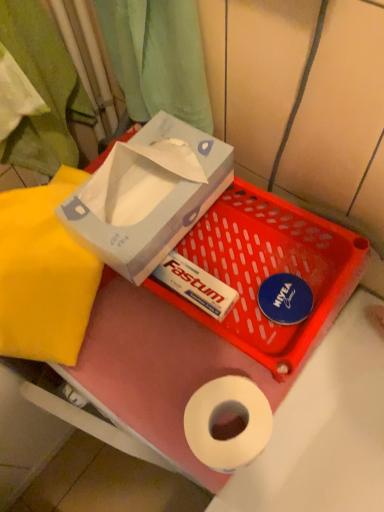
Question: Considering their positions, is green fabric curtain at upper left located in front of or behind yellow fabric at left?

Choices:
 (A) front
 (B) behind

Answer: (A)

Question: From the image's perspective, is green fabric curtain at upper left positioned above or below yellow fabric at left?

Choices:
 (A) above
 (B) below

Answer: (A)

Question: Based on their relative distances, which object is farther from the green fabric curtain at upper left?

Choices:
 (A) white cardboard box at upper center, the second box in the top-to-bottom sequence
 (B) yellow fabric at left
 (C) white cardboard box at upper left, the 2th box from the bottom

Answer: (A)

Question: Which is farther from the green fabric curtain at upper left?

Choices:
 (A) yellow fabric at left
 (B) white cardboard box at upper left, the 2th box from the bottom
 (C) white cardboard box at upper center, positioned as the first box in bottom-to-top order

Answer: (C)